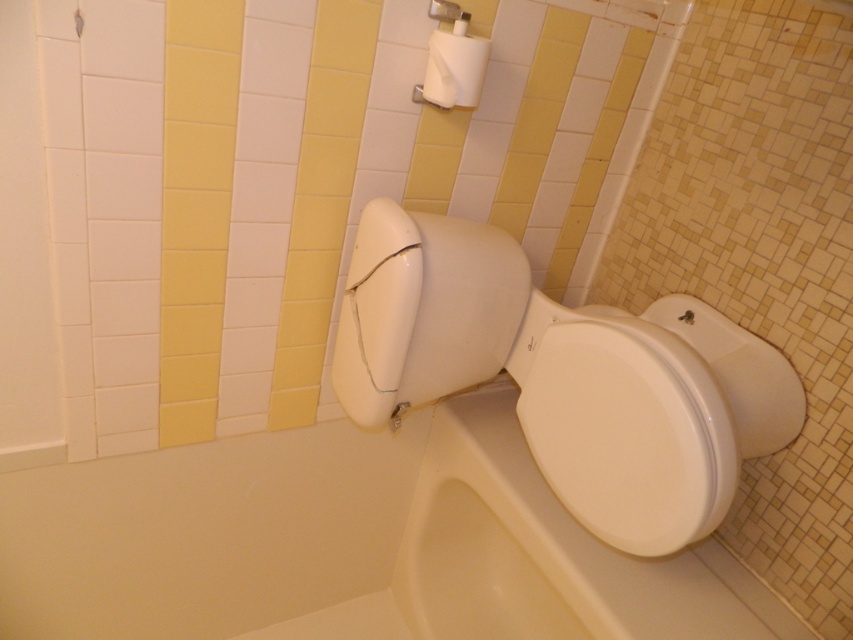
Question: Does white glossy toilet bowl at center come behind white matte toilet paper at upper center?

Choices:
 (A) yes
 (B) no

Answer: (B)

Question: Among these points, which one is farthest from the camera?

Choices:
 (A) (724, 428)
 (B) (465, 36)

Answer: (B)

Question: Which of these objects is positioned farthest from the white glossy toilet bowl at center?

Choices:
 (A) white matte toilet paper at upper center
 (B) white glossy bathtub at lower left

Answer: (A)

Question: Can you confirm if white glossy bathtub at lower left is thinner than white glossy toilet bowl at center?

Choices:
 (A) yes
 (B) no

Answer: (B)

Question: Which of these objects is positioned farthest from the white matte toilet paper at upper center?

Choices:
 (A) white glossy bathtub at lower left
 (B) white glossy toilet bowl at center

Answer: (A)

Question: Does white glossy toilet bowl at center have a greater width compared to white matte toilet paper at upper center?

Choices:
 (A) yes
 (B) no

Answer: (A)